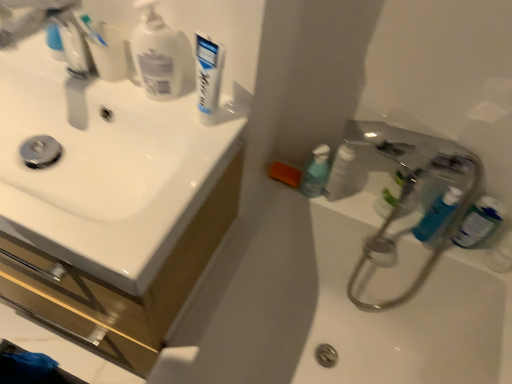
This screenshot has width=512, height=384. What are the coordinates of `vacant space to the left of white glossy toothpaste at upper center` in the screenshot? It's located at (134, 110).